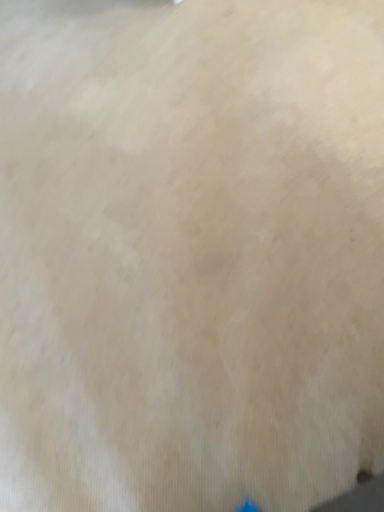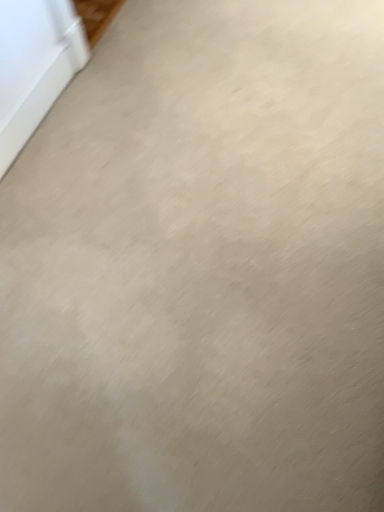
Question: How did the camera likely rotate when shooting the video?

Choices:
 (A) rotated downward
 (B) rotated upward

Answer: (B)